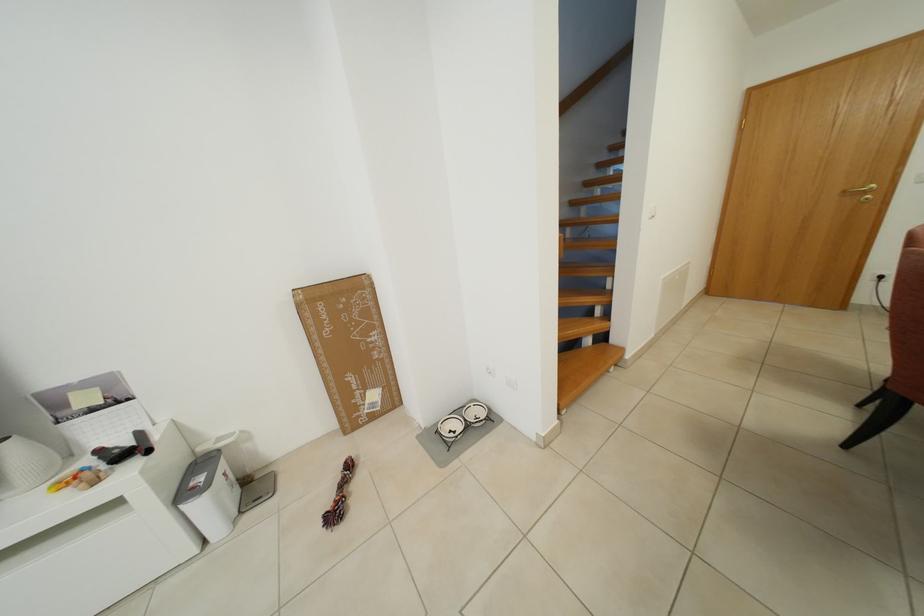
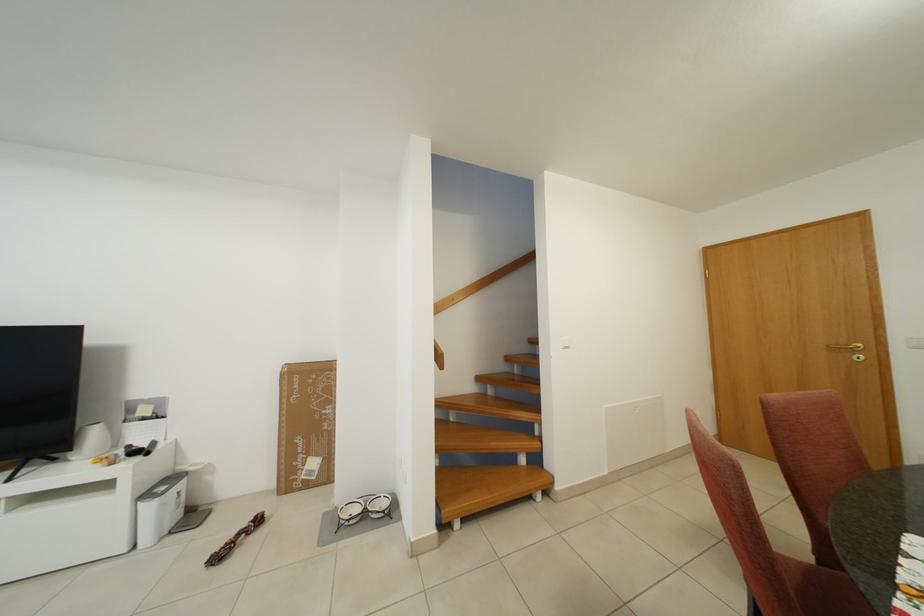
Locate, in the second image, the point that corresponds to [208,484] in the first image.

(171, 493)